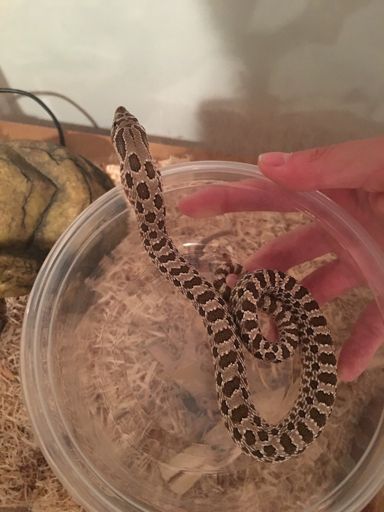
Where is `plastic container`? This screenshot has height=512, width=384. plastic container is located at coordinates (73, 432).